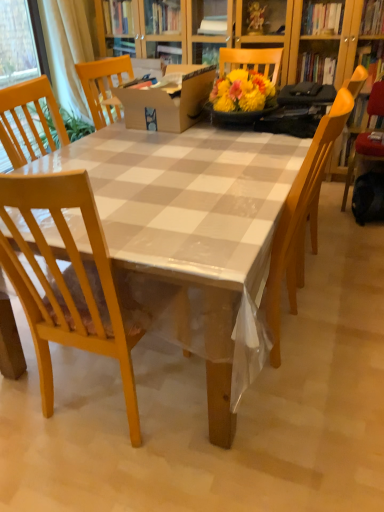
Question: Does light wood chair at left, arranged as the 1th chair when viewed from the left, come in front of wooden chair at center, which appears as the second chair when viewed from the right?

Choices:
 (A) yes
 (B) no

Answer: (A)

Question: Is light wood chair at left, the third chair when ordered from back to front, surrounding wooden chair at center, which appears as the second chair when viewed from the front?

Choices:
 (A) yes
 (B) no

Answer: (B)

Question: Considering the relative sizes of light wood chair at left, the third chair when ordered from back to front, and wooden chair at center, which appears as the second chair when viewed from the front, in the image provided, is light wood chair at left, the third chair when ordered from back to front, taller than wooden chair at center, which appears as the second chair when viewed from the front,?

Choices:
 (A) yes
 (B) no

Answer: (B)

Question: Is light wood chair at left, positioned as the third chair in right-to-left order, directly adjacent to wooden chair at center, which appears as the second chair when viewed from the front?

Choices:
 (A) yes
 (B) no

Answer: (B)

Question: From the image's perspective, does light wood chair at left, positioned as the first chair in front-to-back order, appear lower than wooden chair at center, which appears as the second chair when viewed from the front?

Choices:
 (A) no
 (B) yes

Answer: (B)

Question: Considering the positions of light wood chair at left, the third chair when ordered from back to front, and white sheer curtain at upper left in the image, is light wood chair at left, the third chair when ordered from back to front, wider or thinner than white sheer curtain at upper left?

Choices:
 (A) wide
 (B) thin

Answer: (A)

Question: Is point (104, 340) positioned closer to the camera than point (61, 7)?

Choices:
 (A) farther
 (B) closer

Answer: (B)

Question: From a real-world perspective, relative to white sheer curtain at upper left, is light wood chair at left, positioned as the first chair in front-to-back order, vertically above or below?

Choices:
 (A) above
 (B) below

Answer: (B)

Question: Is light wood chair at left, the third chair when ordered from back to front, situated inside white sheer curtain at upper left or outside?

Choices:
 (A) inside
 (B) outside

Answer: (B)

Question: From the image's perspective, relative to wooden chair at center, placed as the 2th chair when sorted from back to front, is white sheer curtain at upper left above or below?

Choices:
 (A) above
 (B) below

Answer: (A)

Question: Considering their positions, is white sheer curtain at upper left located in front of or behind wooden chair at center, which appears as the second chair when viewed from the right?

Choices:
 (A) behind
 (B) front

Answer: (A)

Question: Considering the positions of white sheer curtain at upper left and wooden chair at center, which appears as the second chair when viewed from the right, in the image, is white sheer curtain at upper left bigger or smaller than wooden chair at center, which appears as the second chair when viewed from the right,?

Choices:
 (A) small
 (B) big

Answer: (A)

Question: From a real-world perspective, is white sheer curtain at upper left above or below wooden chair at center, which appears as the second chair when viewed from the right?

Choices:
 (A) below
 (B) above

Answer: (B)

Question: Based on their sizes in the image, would you say wooden chair at center, which appears as the second chair when viewed from the left, is bigger or smaller than white sheer curtain at upper left?

Choices:
 (A) big
 (B) small

Answer: (A)

Question: From the image's perspective, is wooden chair at center, which appears as the second chair when viewed from the right, above or below white sheer curtain at upper left?

Choices:
 (A) above
 (B) below

Answer: (B)